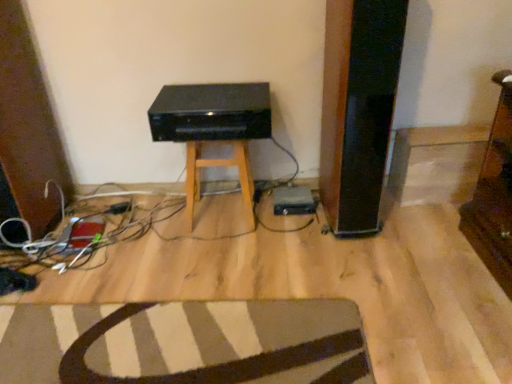
Identify the location of vacant space positioned to the left of black matte stool at center. This screenshot has height=384, width=512. (154, 221).